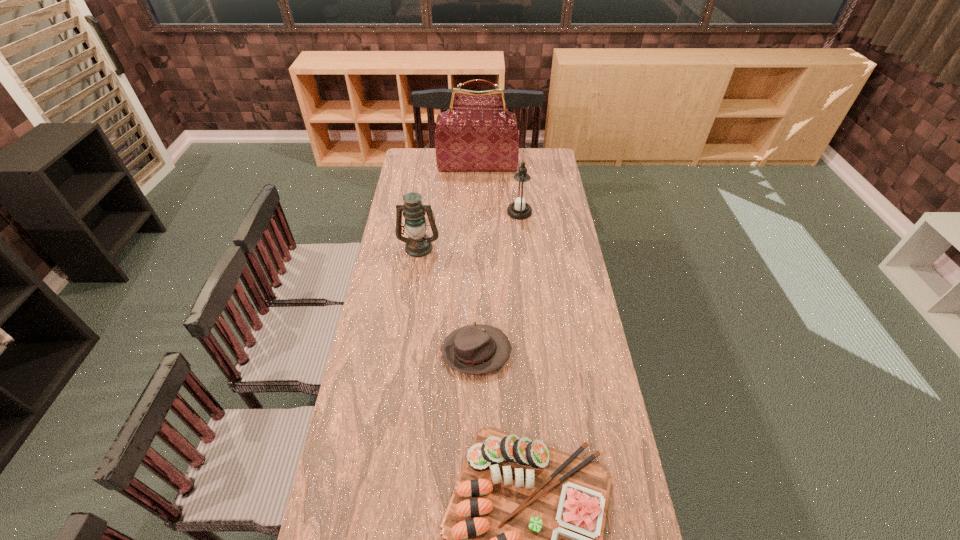
Identify the location of handbag. The image size is (960, 540). (477, 133).

The height and width of the screenshot is (540, 960). Find the location of `the farthest object`. the farthest object is located at coordinates (477, 133).

Locate an element on the screen. This screenshot has height=540, width=960. the right oil lamp is located at coordinates (520, 195).

The image size is (960, 540). What are the coordinates of `the second farthest object` in the screenshot? It's located at tap(520, 195).

In order to click on the third nearest object in this screenshot , I will do `click(418, 244)`.

At what (x,y) coordinates should I click in order to perform the action: click on the left oil lamp. Please return your answer as a coordinate pair (x, y). The height and width of the screenshot is (540, 960). Looking at the image, I should click on (418, 244).

This screenshot has height=540, width=960. What are the coordinates of `the fourth tallest object` in the screenshot? It's located at (x=476, y=349).

Where is `the fourth farthest object`? The image size is (960, 540). the fourth farthest object is located at coordinates (476, 349).

Where is `free space located on the front-facing side of the tallest object`? This screenshot has height=540, width=960. free space located on the front-facing side of the tallest object is located at coordinates (477, 194).

The width and height of the screenshot is (960, 540). Find the location of `vacant space situated on the right of the second farthest object`. vacant space situated on the right of the second farthest object is located at coordinates (563, 212).